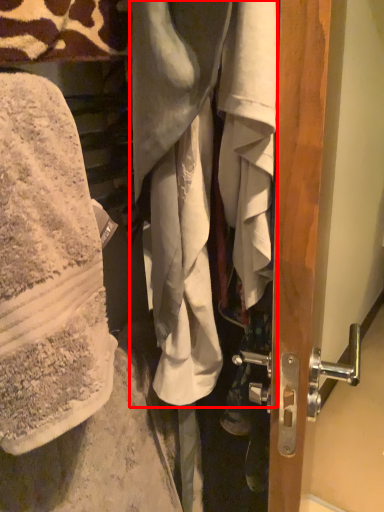
Question: From the image's perspective, considering the relative positions of wrap (annotated by the red box) and wrap in the image provided, where is wrap (annotated by the red box) located with respect to the staircase?

Choices:
 (A) above
 (B) below

Answer: (A)